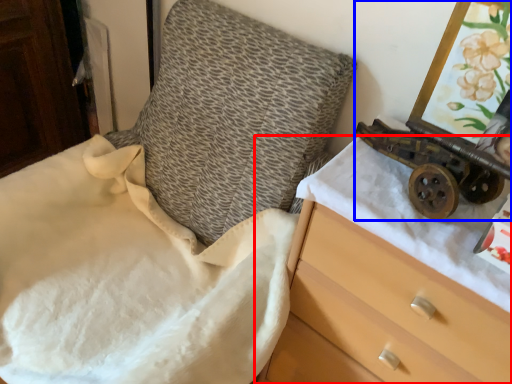
Question: Which object appears farthest to the camera in this image, chest of drawers (highlighted by a red box) or toy (highlighted by a blue box)?

Choices:
 (A) chest of drawers
 (B) toy

Answer: (B)